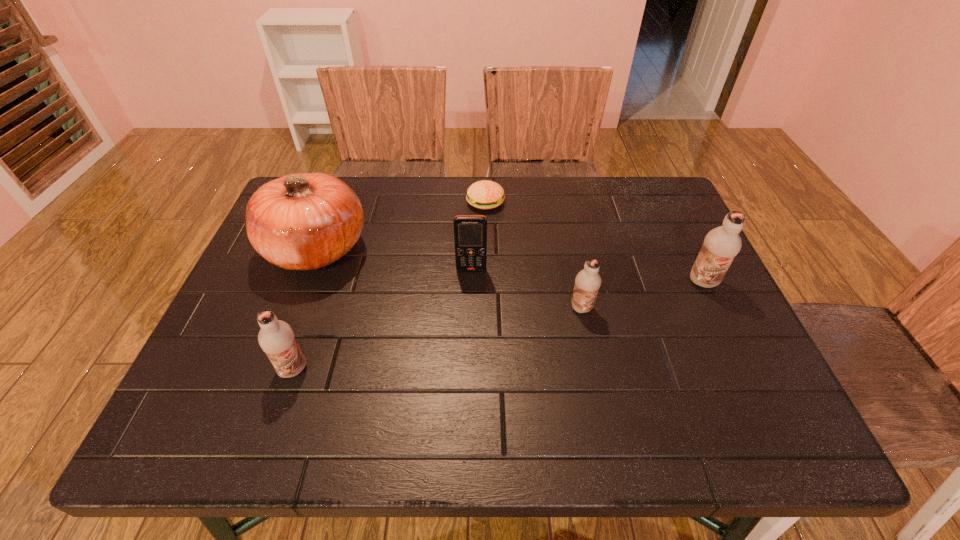
Image resolution: width=960 pixels, height=540 pixels. What are the coordinates of `free space that is in between the pumpkin and the second chocolate milk from left to right` in the screenshot? It's located at (449, 278).

The image size is (960, 540). I want to click on empty space that is in between the second chocolate milk from right to left and the farthest object, so click(x=534, y=255).

Find the location of `vacant region between the second chocolate milk from left to right and the shortest object`. vacant region between the second chocolate milk from left to right and the shortest object is located at coordinates (534, 255).

Image resolution: width=960 pixels, height=540 pixels. I want to click on vacant region between the leftmost chocolate milk and the pumpkin, so click(x=305, y=308).

This screenshot has width=960, height=540. Find the location of `empty space between the cellular telephone and the nearest object`. empty space between the cellular telephone and the nearest object is located at coordinates (382, 320).

Image resolution: width=960 pixels, height=540 pixels. Identify the location of vacant area between the farthest object and the second farthest chocolate milk. (534, 255).

The width and height of the screenshot is (960, 540). Identify the location of free space between the nearest chocolate milk and the patty. (390, 286).

At what (x,y) coordinates should I click in order to perform the action: click on object that is the fourth closest to the pumpkin. Please return your answer as a coordinate pair (x, y). Image resolution: width=960 pixels, height=540 pixels. Looking at the image, I should click on (587, 282).

At what (x,y) coordinates should I click in order to perform the action: click on the third closest object to the rightmost chocolate milk. Please return your answer as a coordinate pair (x, y). Looking at the image, I should click on (485, 194).

The image size is (960, 540). I want to click on chocolate milk that can be found as the closest to the cellular telephone, so click(587, 282).